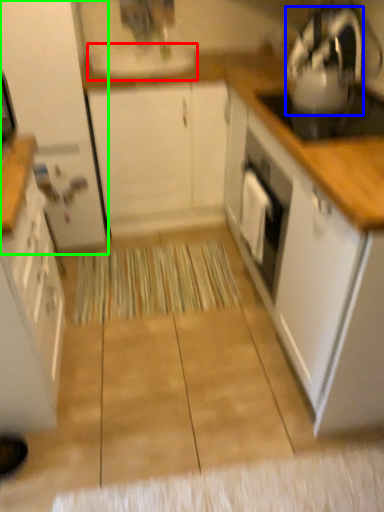
Question: Which is nearer to the sink (highlighted by a red box)? kitchen appliance (highlighted by a blue box) or cabinetry (highlighted by a green box).

Choices:
 (A) kitchen appliance
 (B) cabinetry

Answer: (B)